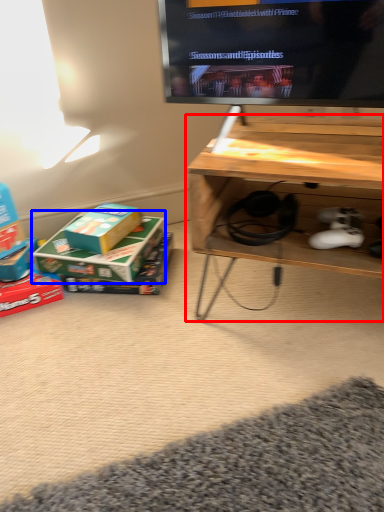
Question: Which point is further to the camera, table (highlighted by a red box) or box (highlighted by a blue box)?

Choices:
 (A) table
 (B) box

Answer: (B)